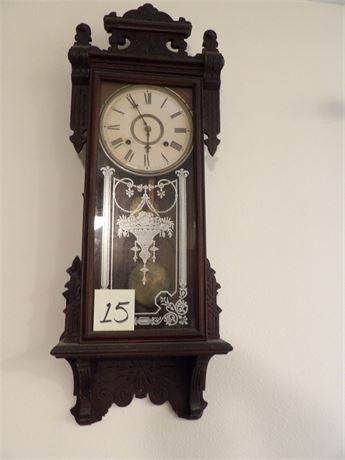
Find the location of a particular element. This screenshot has height=460, width=345. stand is located at coordinates (142, 352).